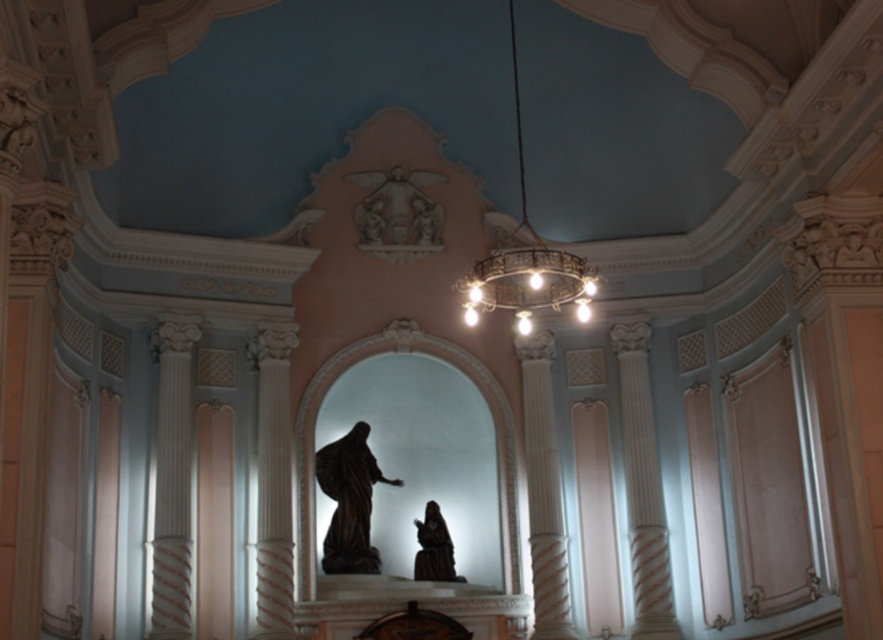
You are standing in the church and want to take a photo of the statue in the niche. The camera you are using has a maximum focus range of 80 meters. Can you focus on the point at coordinates point (472,317)?

The point at coordinates point (472,317) is 78.79 meters from the camera, which is within the maximum focus range of 80 meters. Therefore, the camera can focus on that point.

You are an architect designing a new lighting system for the church. The white stone sculpture at upper center is located at coordinates 0.336, 0.452. To ensure proper lighting, you need to place a spotlight directly above it. What are the coordinates where the spotlight should be placed?

The spotlight should be placed directly above the white stone sculpture at upper center, so the coordinates would be approximately 0.336 in the x and 0.452 in the y, but adjusted vertically to account for the ceiling height. However, based on the provided 2D location, the spotlight should be positioned at the same x and y coordinates, which are 0.336 and 0.452 respectively, to ensure it is directly above.

You are an interior designer planning to install a new lighting fixture in the church. You have a small lamp that is 1 meter in diameter. The gold metallic chandelier at center and the dark brown polished wood statue at center are both in the way. Which object should you move to make space for the lamp?

The gold metallic chandelier at center is bigger than the dark brown polished wood statue at center, so you should move the gold metallic chandelier at center to make space for the lamp since it occupies more area.